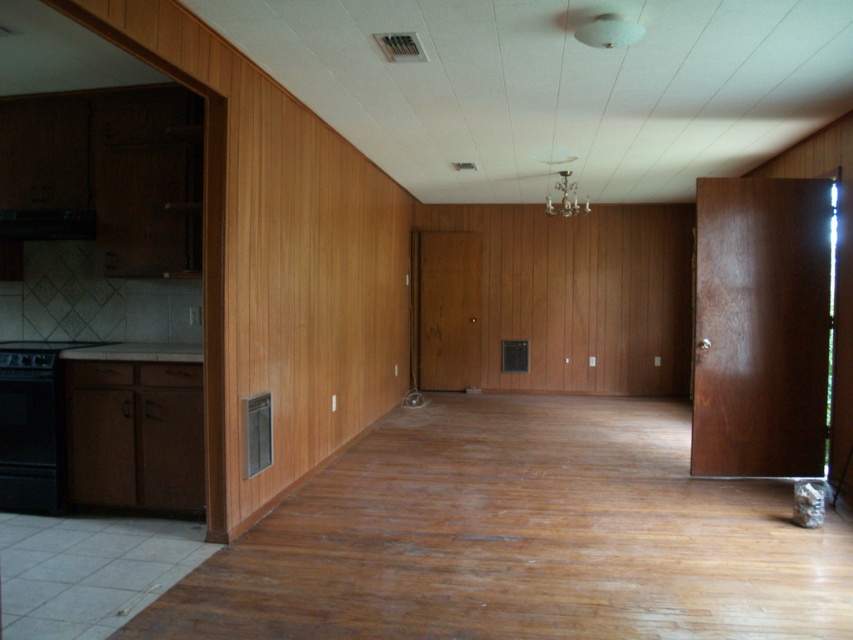
You are a delivery person trying to deliver a large package that is 1 meter wide. You need to pass through the space between the black matte oven at left and the black matte exhaust hood at left. Can the package fit through that space?

The space between the black matte oven at left and the black matte exhaust hood at left is 95.38 centimeters. Since the package is 1 meter wide, which is 100 centimeters, the package cannot fit through the space as it is slightly narrower than the package.